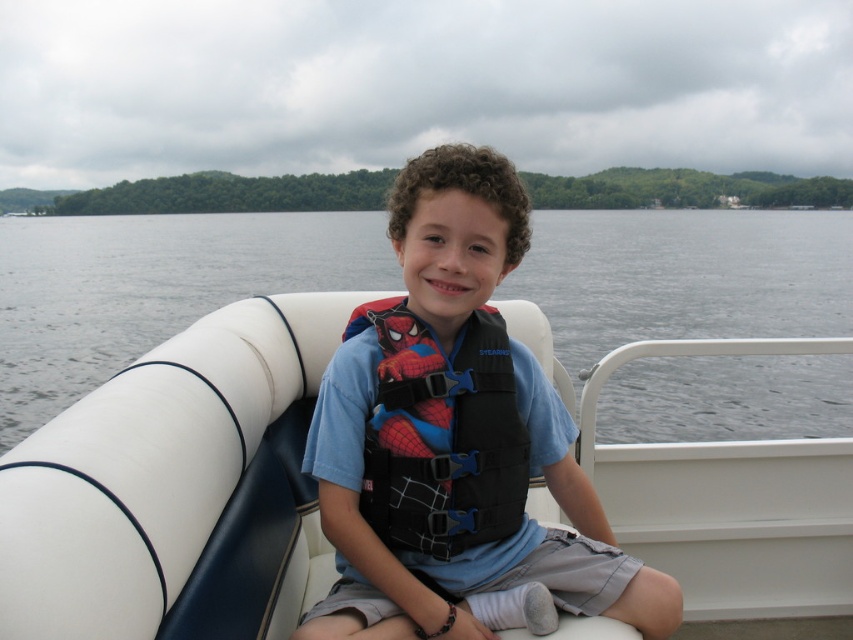
Question: Can you confirm if blue fabric life vest at center is thinner than black fabric life jacket at center?

Choices:
 (A) no
 (B) yes

Answer: (A)

Question: Can you confirm if white vinyl boat at center is positioned to the right of blue fabric life vest at center?

Choices:
 (A) yes
 (B) no

Answer: (B)

Question: In this image, where is white vinyl boat at center located relative to blue fabric life vest at center?

Choices:
 (A) left
 (B) right

Answer: (A)

Question: Estimate the real-world distances between objects in this image. Which object is closer to the blue fabric life vest at center?

Choices:
 (A) black fabric life jacket at center
 (B) white vinyl boat at center

Answer: (A)

Question: Among these points, which one is farthest from the camera?

Choices:
 (A) (463, 381)
 (B) (424, 198)
 (C) (805, 259)

Answer: (C)

Question: Which of the following is the closest to the observer?

Choices:
 (A) blue fabric life vest at center
 (B) black fabric life jacket at center
 (C) clear water at center
 (D) white vinyl boat at center

Answer: (D)